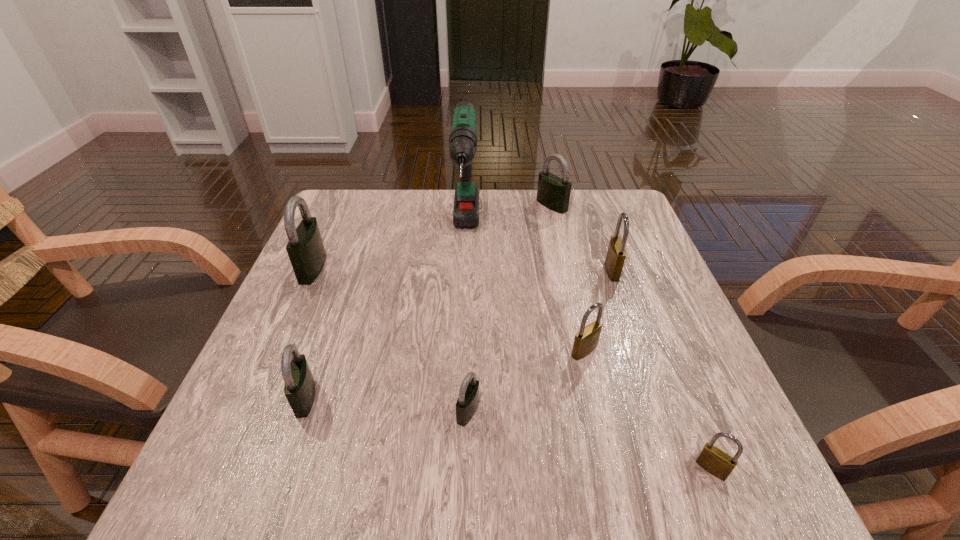
Where is `free spot that satisfies the following two spatial constraints: 1. on the handle side of the tallest object; 2. on the left side of the nearest padlock`? free spot that satisfies the following two spatial constraints: 1. on the handle side of the tallest object; 2. on the left side of the nearest padlock is located at coordinates (456, 469).

Find the location of a particular element. Image resolution: width=960 pixels, height=540 pixels. vacant position in the image that satisfies the following two spatial constraints: 1. on the front side of the second padlock from right to left; 2. on the left side of the tallest padlock is located at coordinates (311, 271).

What are the coordinates of `vacant space that satisfies the following two spatial constraints: 1. on the handle side of the drill; 2. on the right side of the nearest object` in the screenshot? It's located at [x=456, y=469].

The height and width of the screenshot is (540, 960). I want to click on free spot that satisfies the following two spatial constraints: 1. on the handle side of the tallest object; 2. on the right side of the rightmost padlock, so click(456, 469).

What are the coordinates of `free space that satisfies the following two spatial constraints: 1. on the front side of the biggest brass padlock; 2. on the left side of the nearest padlock` in the screenshot? It's located at (681, 469).

Image resolution: width=960 pixels, height=540 pixels. Find the location of `vacant space that satisfies the following two spatial constraints: 1. on the front side of the third biggest black padlock; 2. on the left side of the third black padlock from left to right`. vacant space that satisfies the following two spatial constraints: 1. on the front side of the third biggest black padlock; 2. on the left side of the third black padlock from left to right is located at coordinates (300, 411).